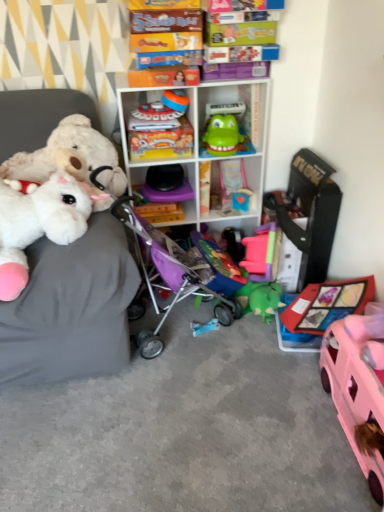
Question: Looking at the image, does shiny metallic train at upper center, which is counted as the third toy, starting from the left, seem bigger or smaller compared to green rubber toy at center, which ranks as the 7th toy in left-to-right order?

Choices:
 (A) big
 (B) small

Answer: (B)

Question: In the image, is shiny metallic train at upper center, which is the eighth toy in right-to-left order, positioned in front of or behind green rubber toy at center, which ranks as the 4th toy in right-to-left order?

Choices:
 (A) front
 (B) behind

Answer: (B)

Question: Considering the real-world distances, which object is farthest from the blue fabric toy at center, the 5th toy when ordered from right to left?

Choices:
 (A) shiny metallic train at upper center, which is the eighth toy in right-to-left order
 (B) pink plastic car at lower right, the first toy in the right-to-left sequence
 (C) black plastic toy at center, the eighth toy viewed from the left
 (D) blue plastic toy at center, the second toy in the right-to-left sequence
 (E) white plastic shelf at center, the second shelf in the bottom-to-top sequence

Answer: (A)

Question: Based on their relative distances, which object is nearer to the black plastic toy at center, the eighth toy viewed from the left?

Choices:
 (A) pink plastic car at lower right, acting as the tenth toy starting from the left
 (B) blue fabric toy at center, the 5th toy when ordered from right to left
 (C) fluffy white plush at left, which appears as the 9th toy when viewed from the right
 (D) shiny metallic train at upper center, which is the eighth toy in right-to-left order
 (E) green rubber toy at center, which ranks as the 7th toy in left-to-right order

Answer: (B)